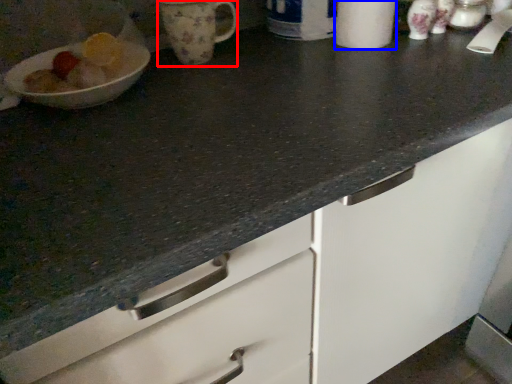
Question: Which of the following is the farthest to the observer, mug (highlighted by a red box) or paper towel (highlighted by a blue box)?

Choices:
 (A) mug
 (B) paper towel

Answer: (A)